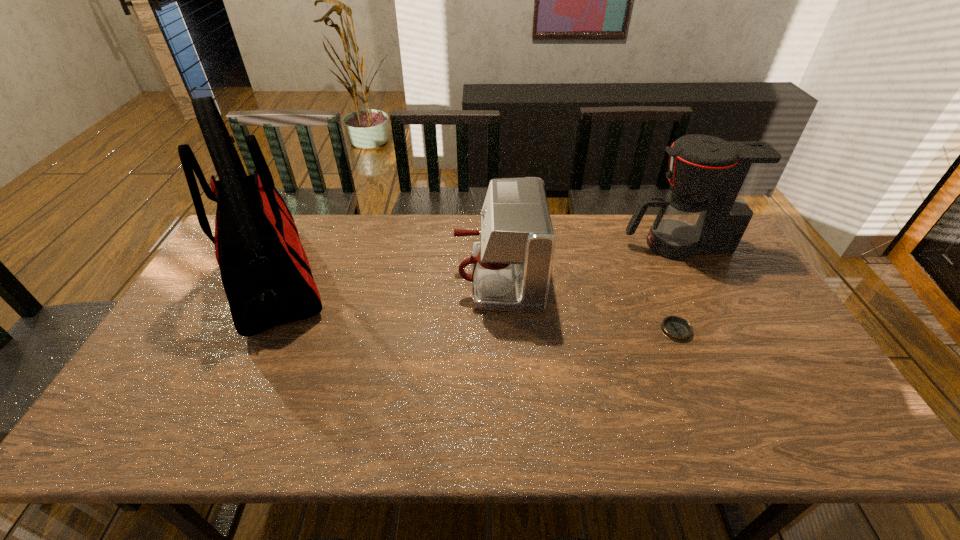
This screenshot has width=960, height=540. Find the location of `free space between the compass and the left coffee maker`. free space between the compass and the left coffee maker is located at coordinates (587, 304).

Where is `free spot between the third object from right to left and the right coffee maker`? This screenshot has width=960, height=540. free spot between the third object from right to left and the right coffee maker is located at coordinates [x=588, y=261].

Identify the location of vacant space that is in between the third tallest object and the tallest object. This screenshot has height=540, width=960. 386,278.

Choose which object is the nearest neighbor to the right coffee maker. Please provide its 2D coordinates. Your answer should be formatted as a tuple, i.e. [(x, y)], where the tuple contains the x and y coordinates of a point satisfying the conditions above.

[(676, 328)]

Where is `object that is the closest to the duffel bag`? Image resolution: width=960 pixels, height=540 pixels. object that is the closest to the duffel bag is located at coordinates (511, 265).

Locate an element on the screen. Image resolution: width=960 pixels, height=540 pixels. vacant area in the image that satisfies the following two spatial constraints: 1. on the front of the shorter coffee maker near the spout; 2. on the front side of the duffel bag is located at coordinates (498, 279).

Identify the location of vacant space that satisfies the following two spatial constraints: 1. on the front of the left coffee maker near the spout; 2. on the back side of the shortest object. (500, 330).

Find the location of a particular element. vacant space that satisfies the following two spatial constraints: 1. on the front of the second shortest object near the spout; 2. on the left side of the shortest object is located at coordinates (500, 330).

Locate an element on the screen. This screenshot has height=540, width=960. vacant point that satisfies the following two spatial constraints: 1. on the front of the second shortest object near the spout; 2. on the left side of the shortest object is located at coordinates (x=500, y=330).

Where is `vacant space that satisfies the following two spatial constraints: 1. on the front of the left coffee maker near the spout; 2. on the back side of the shortest object`? The image size is (960, 540). vacant space that satisfies the following two spatial constraints: 1. on the front of the left coffee maker near the spout; 2. on the back side of the shortest object is located at coordinates (500, 330).